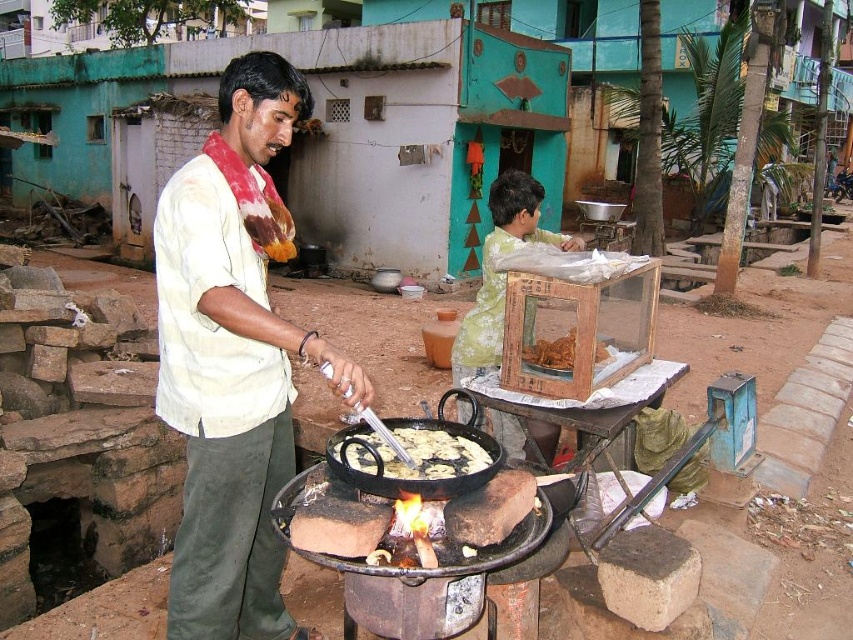
Question: Is the position of golden crispy flatbread at center more distant than that of brown crispy fried food at center?

Choices:
 (A) yes
 (B) no

Answer: (B)

Question: Which of these objects is positioned farthest from the golden crispy flatbread at center?

Choices:
 (A) light beige shirt at center
 (B) brown crispy fried food at center

Answer: (B)

Question: Does golden crispy flatbread at center have a smaller size compared to brown crispy fried food at center?

Choices:
 (A) yes
 (B) no

Answer: (A)

Question: Which of the following is the closest to the observer?

Choices:
 (A) (248, 241)
 (B) (553, 353)
 (C) (436, 445)

Answer: (C)

Question: Considering the real-world distances, which object is farthest from the brown crispy fried food at center?

Choices:
 (A) golden crispy flatbread at center
 (B) light beige shirt at center

Answer: (B)

Question: Does light beige shirt at center have a smaller size compared to golden crispy flatbread at center?

Choices:
 (A) yes
 (B) no

Answer: (B)